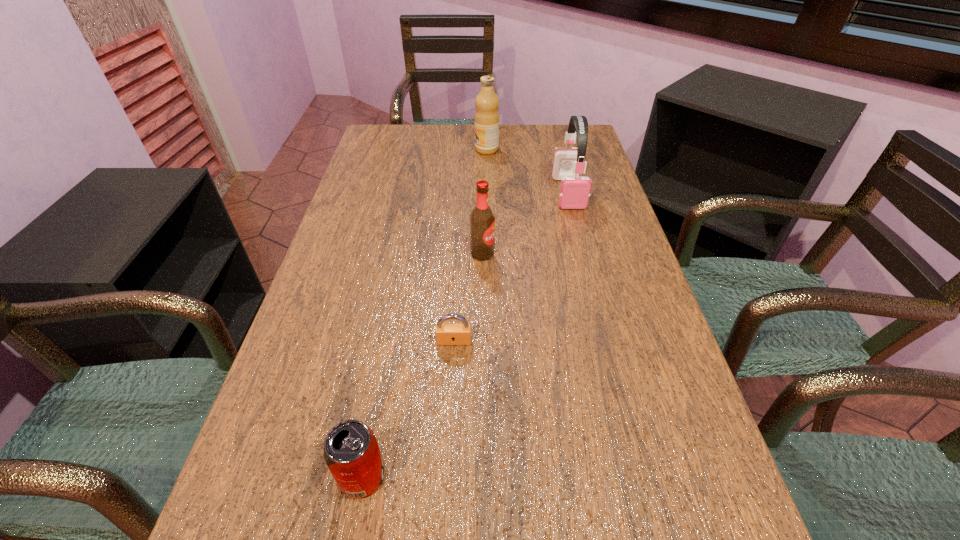
Where is `object that can be found as the second closest to the shortest object`? object that can be found as the second closest to the shortest object is located at coordinates point(351,451).

The image size is (960, 540). I want to click on blank space that satisfies the following two spatial constraints: 1. on the label of the olive oil; 2. to unlock the second nearest object from the front, so click(x=491, y=341).

Locate an element on the screen. The width and height of the screenshot is (960, 540). free location that satisfies the following two spatial constraints: 1. on the label of the farthest object; 2. on the front side of the soda can is located at coordinates (493, 476).